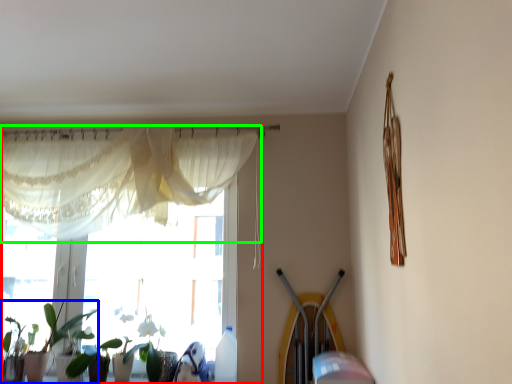
Question: Which object is the farthest from window (highlighted by a red box)? Choose among these: houseplant (highlighted by a blue box) or curtain (highlighted by a green box).

Choices:
 (A) houseplant
 (B) curtain

Answer: (A)